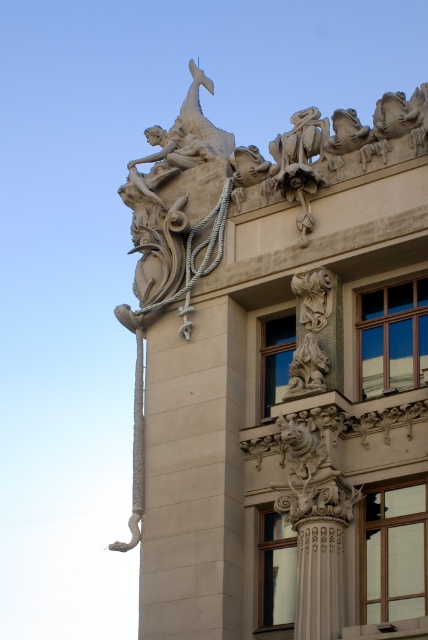
Is beige stone column at center bigger than white stone column at center?

Correct, beige stone column at center is larger in size than white stone column at center.

Is beige stone column at center to the left of white stone column at center from the viewer's perspective?

Indeed, beige stone column at center is positioned on the left side of white stone column at center.

You are a GUI agent. You are given a task and a screenshot of the screen. Output one action in this format:
    pyautogui.click(x=<x>, y=<y>)
    Task: Click on the beige stone column at center
    This screenshot has width=428, height=640.
    Given the screenshot: What is the action you would take?
    pyautogui.click(x=193, y=477)